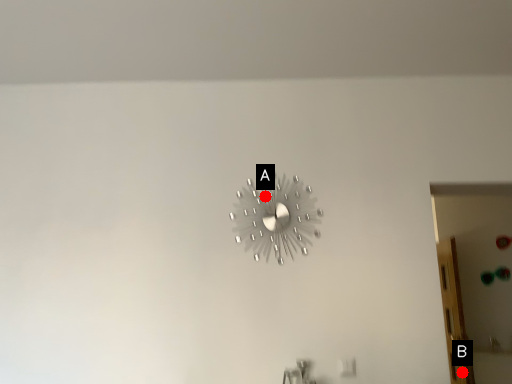
Question: Two points are circled on the image, labeled by A and B beside each circle. Which point is closer to the camera taking this photo?

Choices:
 (A) A is closer
 (B) B is closer

Answer: (A)